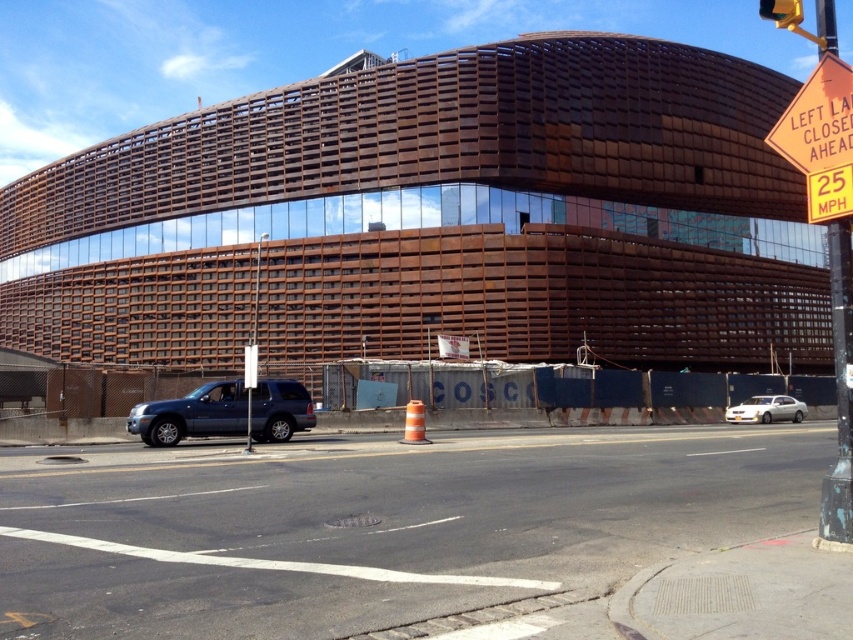
Question: Can you confirm if metallic pole at right is smaller than orange reflective plastic sign at upper right?

Choices:
 (A) no
 (B) yes

Answer: (B)

Question: Which is nearer to the metallic pole at right?

Choices:
 (A) orange reflective plastic sign at upper right
 (B) rustic wood building at center
 (C) black asphalt at lower center

Answer: (C)

Question: Does matte blue suv at center-left have a lesser width compared to metallic pole at right?

Choices:
 (A) no
 (B) yes

Answer: (B)

Question: Is rustic wood building at center positioned in front of white glossy sedan at lower right?

Choices:
 (A) yes
 (B) no

Answer: (B)

Question: Which of the following is the farthest from the observer?

Choices:
 (A) (173, 432)
 (B) (764, 406)
 (C) (610, 326)

Answer: (C)

Question: Which point is closer to the camera taking this photo?

Choices:
 (A) (822, 122)
 (B) (107, 528)
 (C) (848, 406)

Answer: (C)